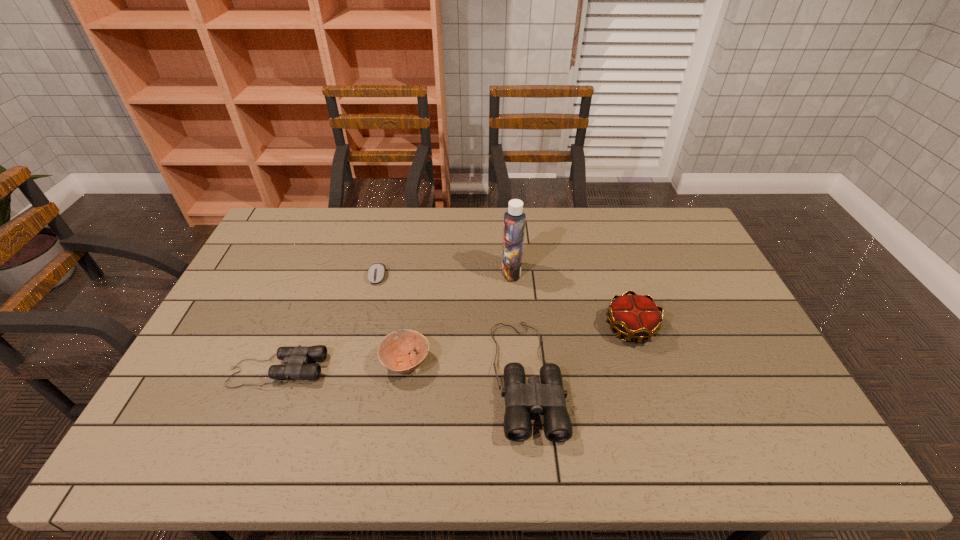
Given the evenly spaced binocularss in the image, where should an extra binoculars be added on the right to preserve the spacing? Please point to a vacant space. Please provide its 2D coordinates. Your answer should be formatted as a tuple, i.e. [(x, y)], where the tuple contains the x and y coordinates of a point satisfying the conditions above.

[(782, 384)]